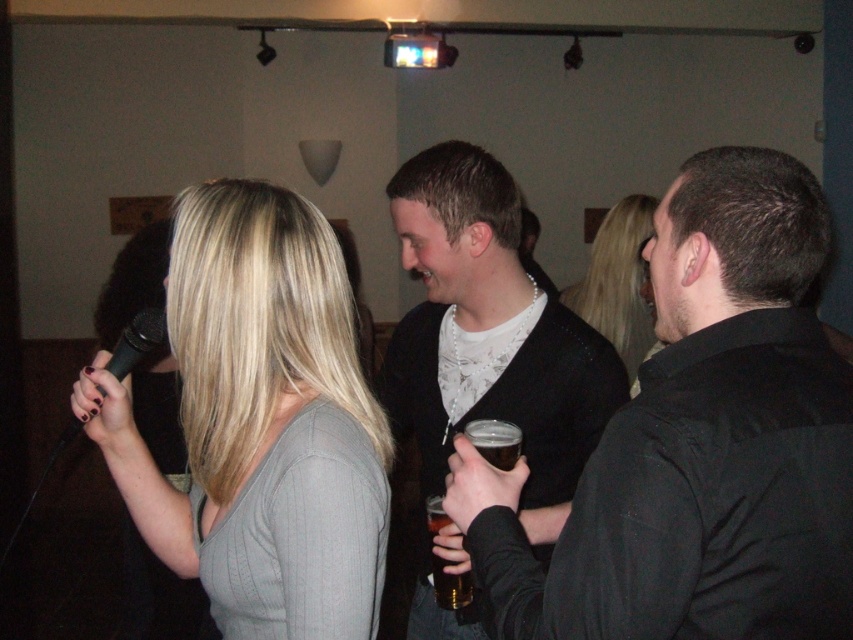
You are a photographer standing at the camera position. You want to capture a closeup shot of the blonde hair at center. Given that your camera can focus on objects within 5 feet, will you be able to take the closeup?

The distance between the blonde hair at center and the camera is 8.97 feet, which is beyond the camera focus range of 5 feet. Therefore, you cannot take a closeup.

You are a photographer at the event and want to capture a photo of the black matte microphone at left. Where exactly is the microphone located in the image?

The black matte microphone at left is located at point (137, 340) in the image.